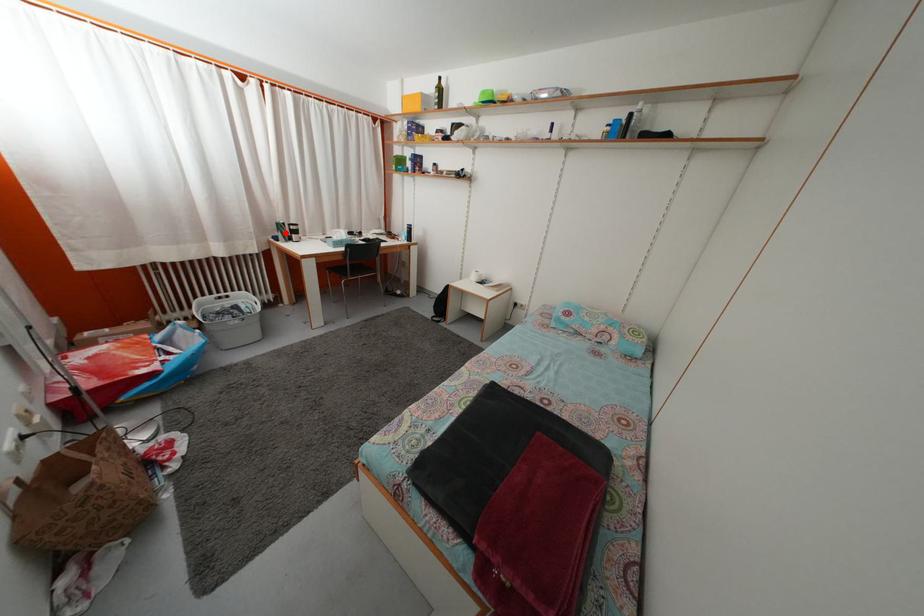
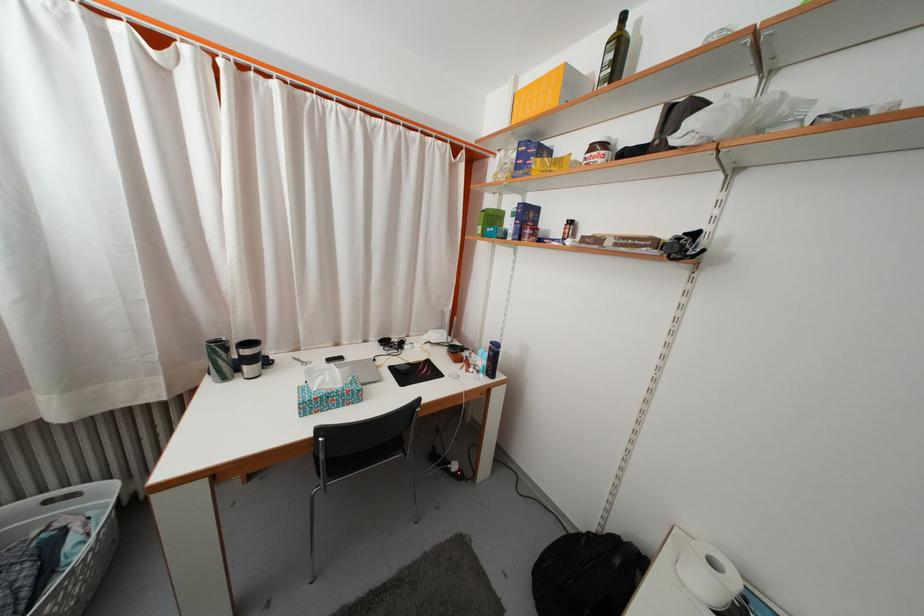
In the second image, find the point that corresponds to the highlighted location in the first image.

(225, 354)